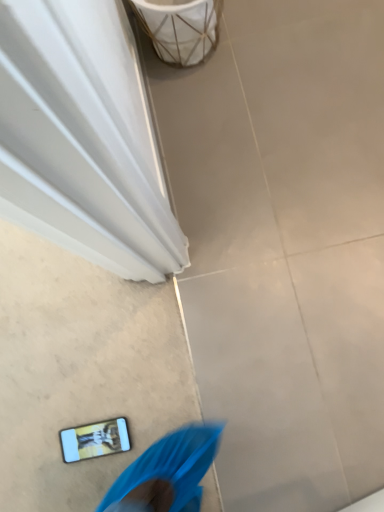
The height and width of the screenshot is (512, 384). Describe the element at coordinates (95, 440) in the screenshot. I see `matte blue tablet at lower left` at that location.

At what (x,y) coordinates should I click in order to perform the action: click on matte blue tablet at lower left. Please return your answer as a coordinate pair (x, y). This screenshot has height=512, width=384. Looking at the image, I should click on (95, 440).

Where is `matte blue tablet at lower left`? Image resolution: width=384 pixels, height=512 pixels. matte blue tablet at lower left is located at coordinates (95, 440).